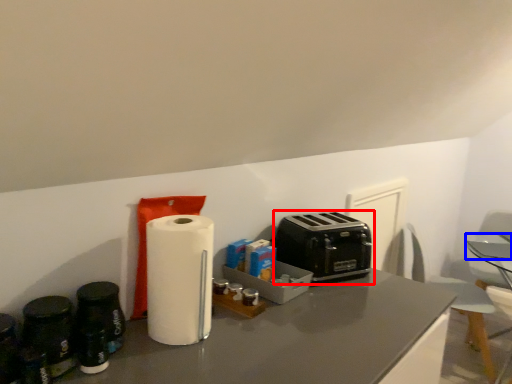
Question: Among these objects, which one is farthest to the camera, toaster (highlighted by a red box) or table (highlighted by a blue box)?

Choices:
 (A) toaster
 (B) table

Answer: (B)